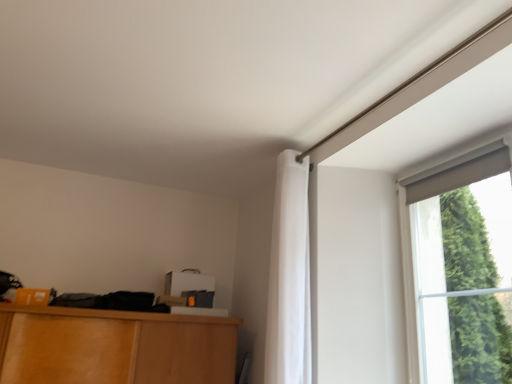
Question: Does matte gray curtain at upper right appear on the left side of white fabric curtain at upper right?

Choices:
 (A) no
 (B) yes

Answer: (A)

Question: Considering the relative sizes of matte gray curtain at upper right and white fabric curtain at upper right in the image provided, is matte gray curtain at upper right thinner than white fabric curtain at upper right?

Choices:
 (A) no
 (B) yes

Answer: (B)

Question: Considering the relative sizes of matte gray curtain at upper right and white fabric curtain at upper right in the image provided, is matte gray curtain at upper right bigger than white fabric curtain at upper right?

Choices:
 (A) yes
 (B) no

Answer: (B)

Question: Is matte gray curtain at upper right far from white fabric curtain at upper right?

Choices:
 (A) yes
 (B) no

Answer: (B)

Question: Is white fabric curtain at upper right completely or partially inside matte gray curtain at upper right?

Choices:
 (A) no
 (B) yes

Answer: (A)

Question: Does matte gray curtain at upper right have a greater width compared to white fabric curtain at upper right?

Choices:
 (A) yes
 (B) no

Answer: (B)

Question: Can you confirm if white fabric curtain at upper right is bigger than matte gray curtain at upper right?

Choices:
 (A) yes
 (B) no

Answer: (A)

Question: Are white fabric curtain at upper right and matte gray curtain at upper right making contact?

Choices:
 (A) no
 (B) yes

Answer: (A)

Question: Is white fabric curtain at upper right closer to the viewer compared to matte gray curtain at upper right?

Choices:
 (A) yes
 (B) no

Answer: (B)

Question: Considering the relative sizes of white fabric curtain at upper right and matte gray curtain at upper right in the image provided, is white fabric curtain at upper right thinner than matte gray curtain at upper right?

Choices:
 (A) no
 (B) yes

Answer: (A)

Question: Is white fabric curtain at upper right oriented towards matte gray curtain at upper right?

Choices:
 (A) yes
 (B) no

Answer: (B)

Question: From a real-world perspective, is white fabric curtain at upper right positioned over matte gray curtain at upper right based on gravity?

Choices:
 (A) yes
 (B) no

Answer: (A)

Question: Is point (294, 355) closer or farther from the camera than point (414, 231)?

Choices:
 (A) closer
 (B) farther

Answer: (A)